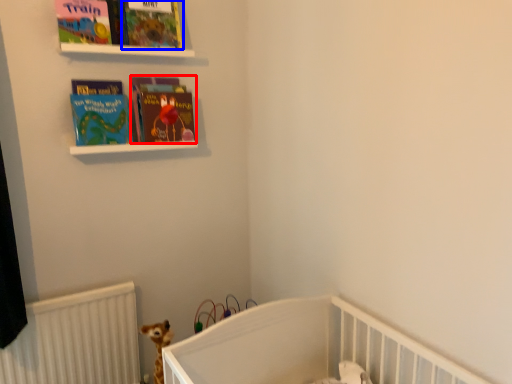
Question: Which point is closer to the camera, book (highlighted by a red box) or book cover (highlighted by a blue box)?

Choices:
 (A) book
 (B) book cover

Answer: (B)